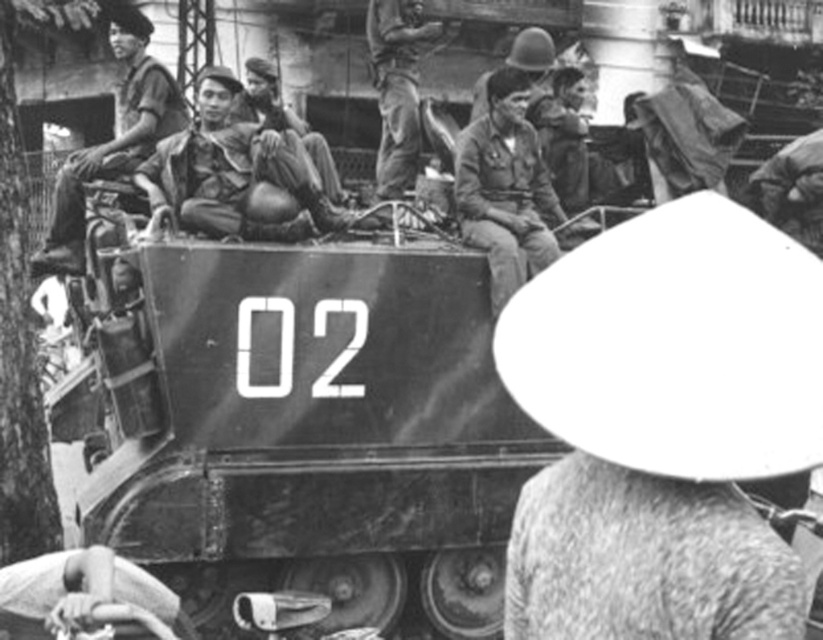
Which is in front, point (182, 144) or point (405, 83)?

Point (182, 144)

Identify the location of camouflage fabric pants at center. (235, 170).

Is point (287, 173) positioned after point (380, 45)?

No.

Locate an element on the screen. The width and height of the screenshot is (823, 640). camouflage fabric pants at center is located at coordinates (235, 170).

Does camouflage fabric uniform at center appear on the left side of matte khaki pants at center?

Incorrect, camouflage fabric uniform at center is not on the left side of matte khaki pants at center.

Image resolution: width=823 pixels, height=640 pixels. In order to click on camouflage fabric uniform at center in this screenshot , I will do `click(504, 188)`.

Where is `camouflage fabric uniform at center`? This screenshot has width=823, height=640. camouflage fabric uniform at center is located at coordinates (504, 188).

Who is positioned more to the right, metallic tank at center or matte khaki uniform at upper left?

From the viewer's perspective, metallic tank at center appears more on the right side.

Can you confirm if metallic tank at center is shorter than matte khaki uniform at upper left?

Correct, metallic tank at center is not as tall as matte khaki uniform at upper left.

At what (x,y) coordinates should I click in order to perform the action: click on metallic tank at center. Please return your answer as a coordinate pair (x, y). The width and height of the screenshot is (823, 640). Looking at the image, I should click on (301, 428).

Identify the location of metallic tank at center. (301, 428).